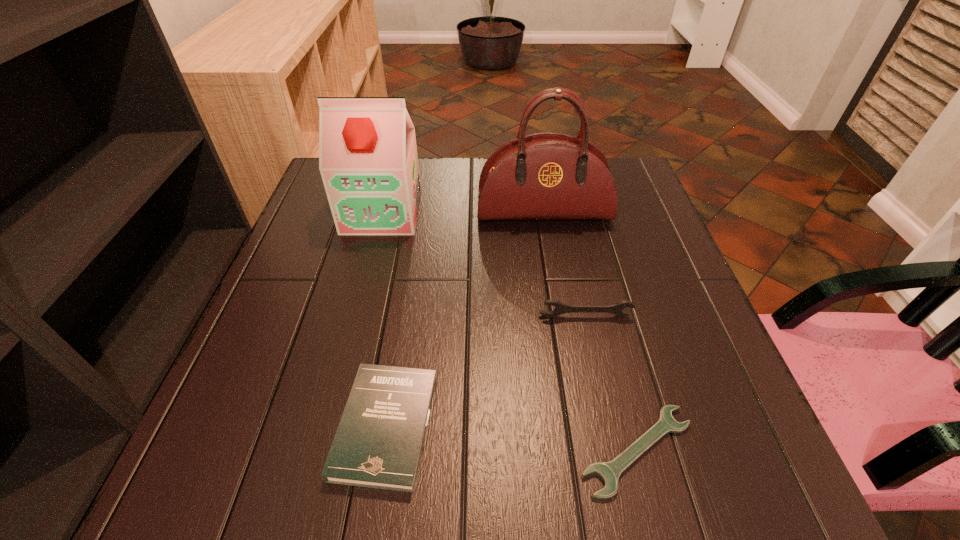
Where is `handbag`? The height and width of the screenshot is (540, 960). handbag is located at coordinates (545, 176).

This screenshot has width=960, height=540. Find the location of `soya milk`. soya milk is located at coordinates (368, 161).

You are a GUI agent. You are given a task and a screenshot of the screen. Output one action in this format:
    pyautogui.click(x=<x>, y=<y>)
    Task: Click on the taller wrench
    
    Given the screenshot: What is the action you would take?
    pyautogui.click(x=617, y=309)

I want to click on the third shortest object, so click(617, 309).

The width and height of the screenshot is (960, 540). I want to click on the second shortest object, so click(378, 444).

This screenshot has width=960, height=540. In order to click on the nearer wrench in this screenshot , I will do tap(609, 472).

This screenshot has width=960, height=540. Identify the location of the shorter wrench. (609, 472).

Find the location of a particular element. The image size is (960, 540). free location located 0.270m on the front-facing side of the handbag is located at coordinates (560, 312).

Locate an element on the screen. Image resolution: width=960 pixels, height=540 pixels. blank space located with the cap open on the soya milk is located at coordinates (354, 318).

At what (x,y) coordinates should I click in order to perform the action: click on free spot located on the open ends of the third tallest object. Please return your answer as a coordinate pair (x, y). The height and width of the screenshot is (540, 960). Looking at the image, I should click on (620, 476).